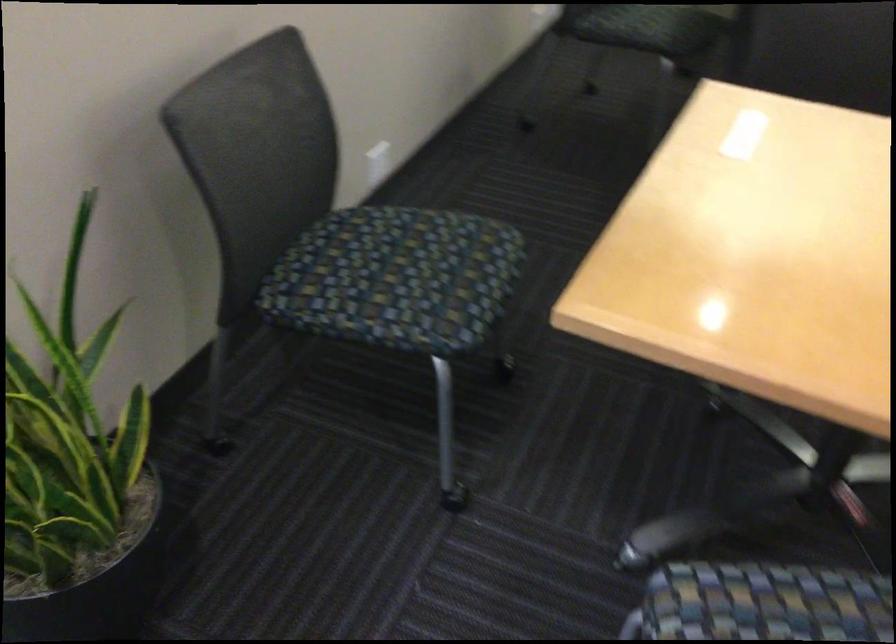
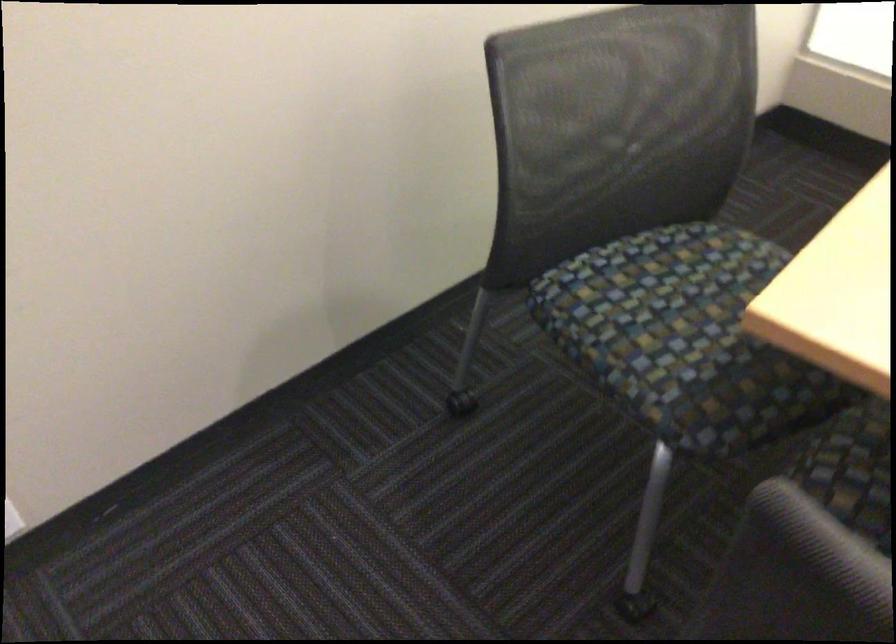
Question: I am providing you with two images of the same scene from different viewpoints. Please identify which objects are invisible in image2.

Choices:
 (A) red toy figure
 (B) chair armrest
 (C) chair sitting surface
 (D) dark chair seat

Answer: (D)